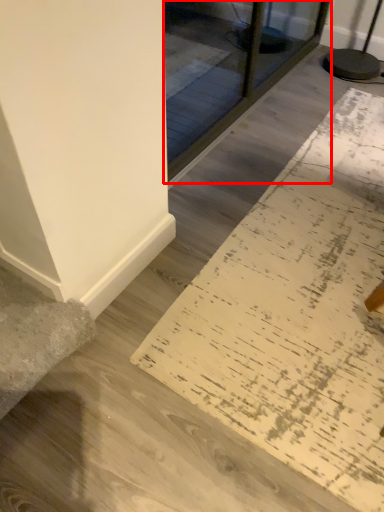
Question: From the image's perspective, what is the correct spatial positioning of glass door (annotated by the red box) in reference to doormat?

Choices:
 (A) below
 (B) above

Answer: (B)